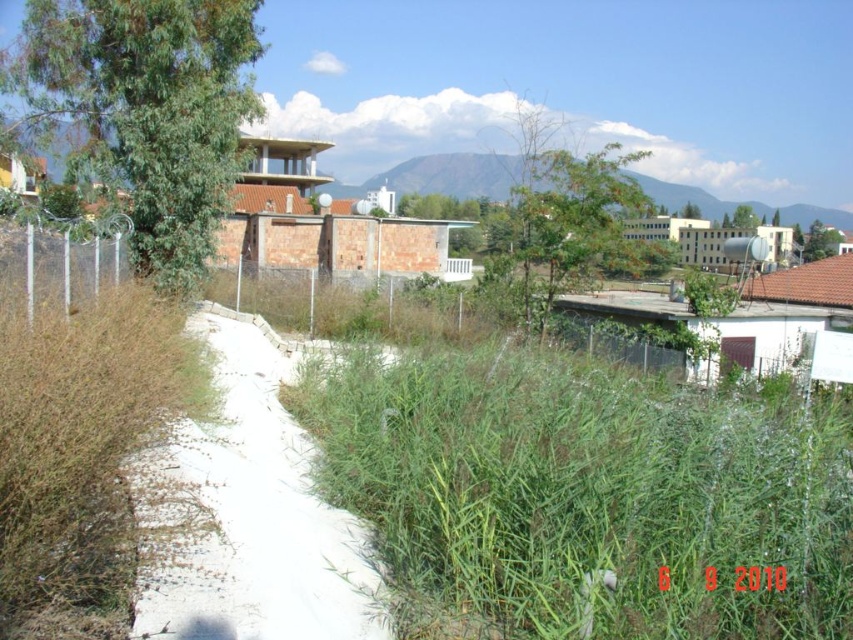
Is point (282, 577) closer to viewer compared to point (403, 161)?

Yes, it is.

Between white concrete path at center and green grassy hillside at upper center, which one has less height?

Standing shorter between the two is white concrete path at center.

The height and width of the screenshot is (640, 853). I want to click on white concrete path at center, so click(247, 515).

Locate an element on the screen. Image resolution: width=853 pixels, height=640 pixels. white concrete path at center is located at coordinates (247, 515).

Is green grass at center to the right of green grassy hillside at upper center from the viewer's perspective?

Incorrect, green grass at center is not on the right side of green grassy hillside at upper center.

Can you confirm if green grass at center is positioned to the left of green grassy hillside at upper center?

Correct, you'll find green grass at center to the left of green grassy hillside at upper center.

Identify the location of green grass at center. The width and height of the screenshot is (853, 640). (590, 493).

Where is `green grass at center`? The image size is (853, 640). green grass at center is located at coordinates (590, 493).

Between point (821, 500) and point (207, 513), which one is positioned in front?

Point (821, 500) is more forward.

This screenshot has height=640, width=853. What are the coordinates of `green grass at center` in the screenshot? It's located at (590, 493).

Between point (428, 541) and point (309, 556), which one is positioned behind?

The point (309, 556) is behind.

Locate an element on the screen. The image size is (853, 640). green grass at center is located at coordinates (590, 493).